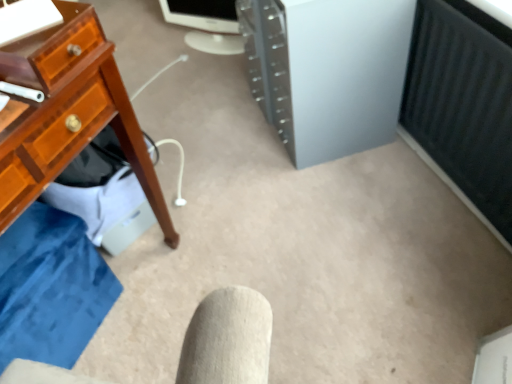
Question: Is white glossy monitor at upper center a part of satin silver tower at center?

Choices:
 (A) no
 (B) yes

Answer: (A)

Question: Does satin silver tower at center appear on the left side of white glossy monitor at upper center?

Choices:
 (A) no
 (B) yes

Answer: (A)

Question: From the image's perspective, is satin silver tower at center below white glossy monitor at upper center?

Choices:
 (A) yes
 (B) no

Answer: (A)

Question: From a real-world perspective, is satin silver tower at center under white glossy monitor at upper center?

Choices:
 (A) no
 (B) yes

Answer: (A)

Question: Is satin silver tower at center thinner than white glossy monitor at upper center?

Choices:
 (A) yes
 (B) no

Answer: (B)

Question: Does satin silver tower at center turn towards white glossy monitor at upper center?

Choices:
 (A) no
 (B) yes

Answer: (A)

Question: Can you confirm if white glossy monitor at upper center is shorter than satin silver tower at center?

Choices:
 (A) no
 (B) yes

Answer: (B)

Question: Can you confirm if white glossy monitor at upper center is smaller than satin silver tower at center?

Choices:
 (A) yes
 (B) no

Answer: (A)

Question: Is white glossy monitor at upper center at the right side of satin silver tower at center?

Choices:
 (A) yes
 (B) no

Answer: (B)

Question: Can you see white glossy monitor at upper center touching satin silver tower at center?

Choices:
 (A) no
 (B) yes

Answer: (A)

Question: Is white glossy monitor at upper center wider than satin silver tower at center?

Choices:
 (A) no
 (B) yes

Answer: (A)

Question: Is satin silver tower at center inside white glossy monitor at upper center?

Choices:
 (A) no
 (B) yes

Answer: (A)

Question: Choose the correct answer: Is satin silver tower at center inside white glossy monitor at upper center or outside it?

Choices:
 (A) inside
 (B) outside

Answer: (B)